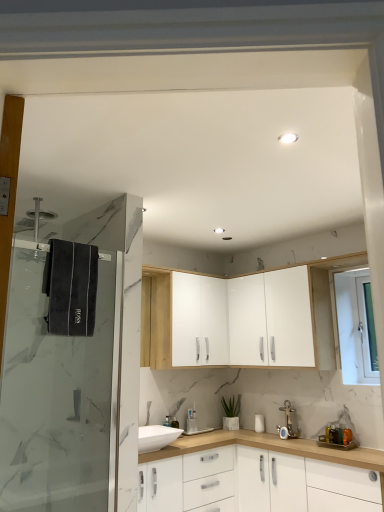
Question: From the image's perspective, is green matte plant at lower center on transparent glass shower door at left?

Choices:
 (A) yes
 (B) no

Answer: (B)

Question: Can you confirm if green matte plant at lower center is taller than transparent glass shower door at left?

Choices:
 (A) yes
 (B) no

Answer: (B)

Question: Does green matte plant at lower center come behind transparent glass shower door at left?

Choices:
 (A) yes
 (B) no

Answer: (A)

Question: Considering the relative positions of green matte plant at lower center and transparent glass shower door at left in the image provided, is green matte plant at lower center to the right of transparent glass shower door at left from the viewer's perspective?

Choices:
 (A) yes
 (B) no

Answer: (A)

Question: Considering the relative sizes of green matte plant at lower center and transparent glass shower door at left in the image provided, is green matte plant at lower center smaller than transparent glass shower door at left?

Choices:
 (A) no
 (B) yes

Answer: (B)

Question: Considering the relative sizes of green matte plant at lower center and transparent glass shower door at left in the image provided, is green matte plant at lower center shorter than transparent glass shower door at left?

Choices:
 (A) yes
 (B) no

Answer: (A)

Question: From a real-world perspective, is white glossy door at upper right on transparent glass shower door at left?

Choices:
 (A) no
 (B) yes

Answer: (B)

Question: Is white glossy door at upper right not within transparent glass shower door at left?

Choices:
 (A) yes
 (B) no

Answer: (A)

Question: Is white glossy door at upper right positioned behind transparent glass shower door at left?

Choices:
 (A) no
 (B) yes

Answer: (B)

Question: Considering the relative sizes of white glossy door at upper right and transparent glass shower door at left in the image provided, is white glossy door at upper right shorter than transparent glass shower door at left?

Choices:
 (A) yes
 (B) no

Answer: (A)

Question: Is white glossy door at upper right turned away from transparent glass shower door at left?

Choices:
 (A) no
 (B) yes

Answer: (A)

Question: From the image's perspective, would you say white glossy door at upper right is positioned over transparent glass shower door at left?

Choices:
 (A) yes
 (B) no

Answer: (A)

Question: Does gold metallic faucet at lower right have a lesser height compared to white matte cabinet at center, acting as the 3th cabinetry starting from the top?

Choices:
 (A) yes
 (B) no

Answer: (A)